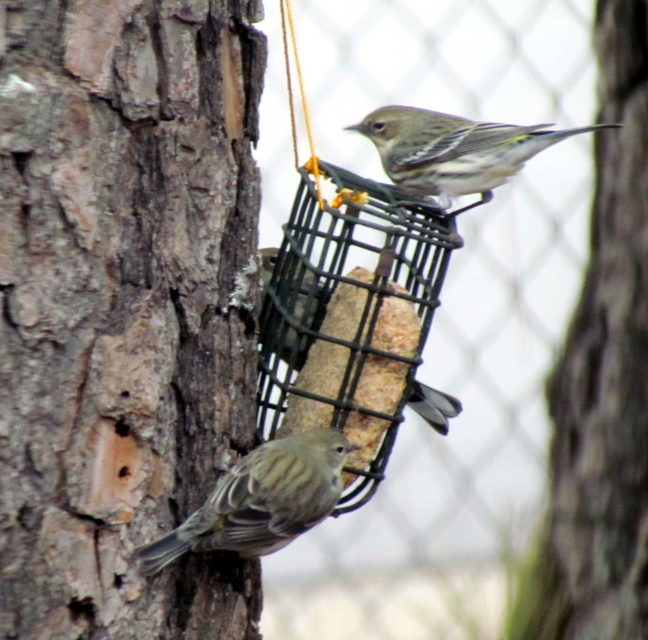
Question: Which point appears farthest from the camera in this image?

Choices:
 (A) (248, 525)
 (B) (170, 221)
 (C) (349, 278)
 (D) (399, 163)

Answer: (D)

Question: Is smooth bark tree trunk at left bigger than greenish-yellow feathers at center?

Choices:
 (A) no
 (B) yes

Answer: (B)

Question: Can you confirm if smooth bark tree trunk at left is bigger than black wire mesh bird feeder at center?

Choices:
 (A) no
 (B) yes

Answer: (B)

Question: Among these objects, which one is farthest from the camera?

Choices:
 (A) greenish-yellow feathers at center
 (B) black wire mesh bird feeder at center
 (C) brown speckled bird at lower left
 (D) smooth bark tree trunk at left

Answer: (A)

Question: Which point appears farthest from the camera in this image?

Choices:
 (A) (211, 541)
 (B) (411, 152)

Answer: (B)

Question: Is brown speckled bird at lower left smaller than greenish-yellow feathers at center?

Choices:
 (A) no
 (B) yes

Answer: (B)